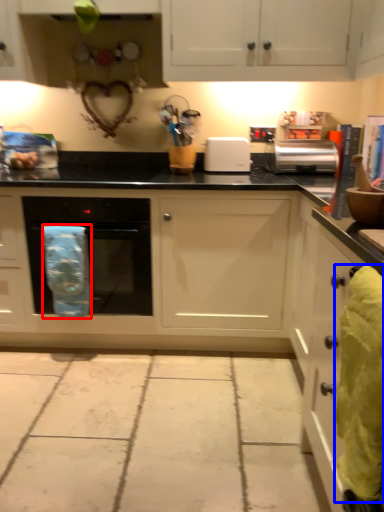
Question: Which of the following is the farthest to the observer, material (highlighted by a red box) or material (highlighted by a blue box)?

Choices:
 (A) material
 (B) material

Answer: (A)